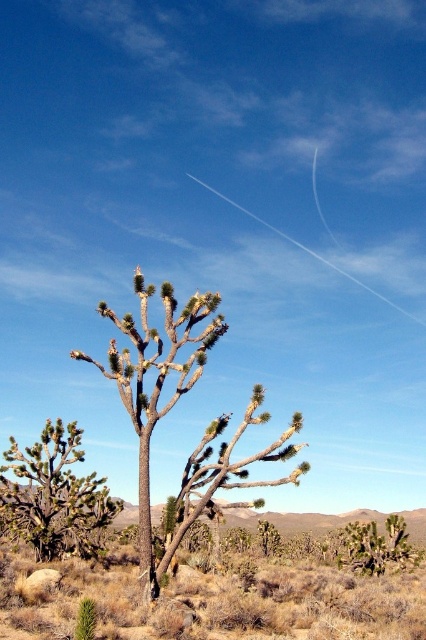
Question: Which of the following is the closest to the observer?

Choices:
 (A) (71, 550)
 (B) (250, 412)

Answer: (B)

Question: Can you confirm if brown textured tree at center is bigger than green spiky cactus at center?

Choices:
 (A) no
 (B) yes

Answer: (B)

Question: Which point is closer to the camera?

Choices:
 (A) (138, 268)
 (B) (69, 486)

Answer: (A)

Question: Is brown textured tree at center to the right of green spiky cactus at center from the viewer's perspective?

Choices:
 (A) no
 (B) yes

Answer: (B)

Question: Can you confirm if brown textured tree at center is positioned to the left of green spiky cactus at center?

Choices:
 (A) no
 (B) yes

Answer: (A)